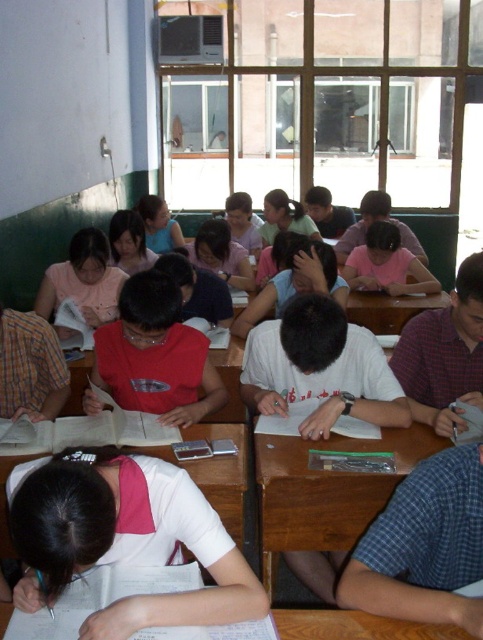
You are a student trying to place your new notebook on the desk. The notebook is as wide as your white matte shirt at center. Will it fit on the wooden desk at center?

The white matte shirt at center is narrower than the wooden desk at center, so the notebook, being as wide as the shirt, will fit on the desk.

You are a student sitting in the classroom and need to reach the wooden desk at center to grab your notebook. However, there is an obstacle in the form of the white matte shirt at center. Can you move the shirt to access the desk?

The white matte shirt at center is above the wooden desk at center, so you can move the shirt to access the desk.